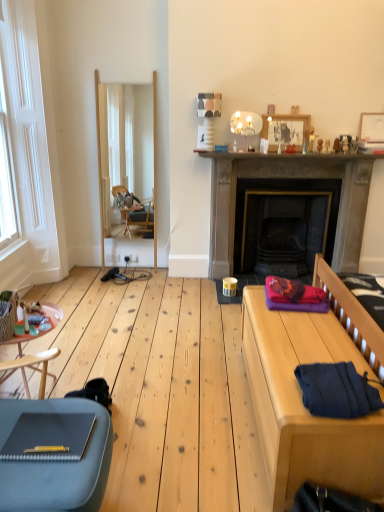
Question: Is wooden side table at lower left wider than wooden picture frame at upper center, the 1th picture frame when ordered from left to right?

Choices:
 (A) no
 (B) yes

Answer: (B)

Question: Is wooden side table at lower left at the left side of wooden picture frame at upper center, acting as the 2th picture frame starting from the right?

Choices:
 (A) yes
 (B) no

Answer: (A)

Question: Is wooden side table at lower left facing towards wooden picture frame at upper center, acting as the 2th picture frame starting from the right?

Choices:
 (A) no
 (B) yes

Answer: (A)

Question: Is wooden side table at lower left positioned with its back to wooden picture frame at upper center, the 1th picture frame when ordered from left to right?

Choices:
 (A) yes
 (B) no

Answer: (B)

Question: From a real-world perspective, is wooden side table at lower left positioned under wooden picture frame at upper center, the 1th picture frame when ordered from left to right, based on gravity?

Choices:
 (A) no
 (B) yes

Answer: (B)

Question: From their relative heights in the image, would you say dark blue knitted sweater at lower right is taller or shorter than dark gray stone fireplace at center?

Choices:
 (A) short
 (B) tall

Answer: (A)

Question: From the image's perspective, is dark blue knitted sweater at lower right located above or below dark gray stone fireplace at center?

Choices:
 (A) above
 (B) below

Answer: (B)

Question: Is dark blue knitted sweater at lower right in front of or behind dark gray stone fireplace at center in the image?

Choices:
 (A) front
 (B) behind

Answer: (A)

Question: Considering the positions of dark blue knitted sweater at lower right and dark gray stone fireplace at center in the image, is dark blue knitted sweater at lower right wider or thinner than dark gray stone fireplace at center?

Choices:
 (A) thin
 (B) wide

Answer: (A)

Question: Is white wood window at left bigger or smaller than wooden frame mirror at center?

Choices:
 (A) big
 (B) small

Answer: (B)

Question: Is point (11, 231) positioned closer to the camera than point (148, 125)?

Choices:
 (A) farther
 (B) closer

Answer: (B)

Question: Considering the relative positions of white wood window at left and wooden frame mirror at center in the image provided, is white wood window at left to the left or to the right of wooden frame mirror at center?

Choices:
 (A) right
 (B) left

Answer: (B)

Question: Considering the positions of white wood window at left and wooden frame mirror at center in the image, is white wood window at left taller or shorter than wooden frame mirror at center?

Choices:
 (A) short
 (B) tall

Answer: (A)

Question: Which is correct: dark blue knitted sweater at lower right is inside white wood window at left, or outside of it?

Choices:
 (A) outside
 (B) inside

Answer: (A)

Question: Considering the positions of dark blue knitted sweater at lower right and white wood window at left in the image, is dark blue knitted sweater at lower right wider or thinner than white wood window at left?

Choices:
 (A) wide
 (B) thin

Answer: (A)